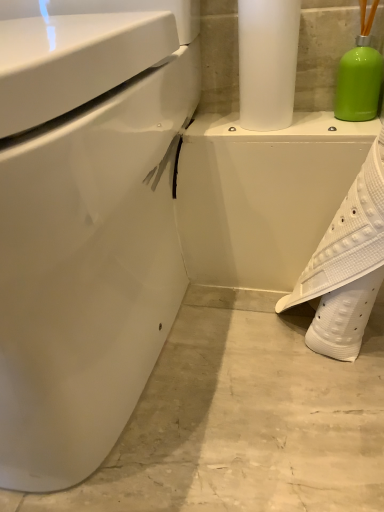
Describe the element at coordinates (267, 62) in the screenshot. The width and height of the screenshot is (384, 512). I see `satin white paper towel at upper center` at that location.

Identify the location of white textured shoe at lower right. (346, 266).

You are a GUI agent. You are given a task and a screenshot of the screen. Output one action in this format:
    pyautogui.click(x=<x>, y=<y>)
    Task: Click on the porcelain above the white glossy toilet at left (from the image's perspective)
    
    Given the screenshot: What is the action you would take?
    pyautogui.click(x=263, y=195)

Considering the sizes of objects white glossy toilet at left and white glossy porcelain at center in the image provided, who is smaller, white glossy toilet at left or white glossy porcelain at center?

white glossy porcelain at center.

From a real-world perspective, who is located lower, white glossy toilet at left or white glossy porcelain at center?

white glossy porcelain at center, from a real-world perspective.

Does satin white paper towel at upper center come in front of white glossy porcelain at center?

Yes, satin white paper towel at upper center is closer to the viewer.

Is satin white paper towel at upper center facing away from white glossy porcelain at center?

satin white paper towel at upper center does not have its back to white glossy porcelain at center.

Between satin white paper towel at upper center and white glossy porcelain at center, which one has larger width?

white glossy porcelain at center is wider.

Is satin white paper towel at upper center shorter than white glossy porcelain at center?

No, satin white paper towel at upper center is not shorter than white glossy porcelain at center.

Is point (239, 42) positioned before point (101, 390)?

No, it is behind (101, 390).

Which object is positioned more to the left, satin white paper towel at upper center or white glossy toilet at left?

From the viewer's perspective, white glossy toilet at left appears more on the left side.

From the image's perspective, which is above, satin white paper towel at upper center or white glossy toilet at left?

satin white paper towel at upper center appears higher in the image.

Who is smaller, white textured shoe at lower right or white glossy toilet at left?

white textured shoe at lower right.

Is point (350, 258) farther from camera compared to point (42, 438)?

Yes, point (350, 258) is behind point (42, 438).

Is white glossy toilet at left inside white textured shoe at lower right?

No.

Does white textured shoe at lower right appear on the left side of white glossy toilet at left?

Incorrect, white textured shoe at lower right is not on the left side of white glossy toilet at left.

Who is shorter, white textured shoe at lower right or satin white paper towel at upper center?

Standing shorter between the two is satin white paper towel at upper center.

The height and width of the screenshot is (512, 384). Identify the location of paper towel that appears above the white textured shoe at lower right (from the image's perspective). (267, 62).

Is white textured shoe at lower right oriented towards satin white paper towel at upper center?

No, white textured shoe at lower right is not turned towards satin white paper towel at upper center.

Which is more to the left, white textured shoe at lower right or satin white paper towel at upper center?

From the viewer's perspective, satin white paper towel at upper center appears more on the left side.

Which is less distant, [219,123] or [244,16]?

Point [244,16]

How different are the orientations of white glossy porcelain at center and satin white paper towel at upper center in degrees?

1.95 degrees separate the facing orientations of white glossy porcelain at center and satin white paper towel at upper center.

Is satin white paper towel at upper center inside white glossy porcelain at center?

No.

Is white glossy porcelain at center bigger or smaller than white textured shoe at lower right?

In the image, white glossy porcelain at center appears to be larger than white textured shoe at lower right.

From the image's perspective, is white glossy porcelain at center above or below white textured shoe at lower right?

white glossy porcelain at center is above white textured shoe at lower right.

Is white glossy porcelain at center looking in the opposite direction of white textured shoe at lower right?

white glossy porcelain at center is not turned away from white textured shoe at lower right.

In the image, there is a white glossy porcelain at center. Where is `toilet below it (from the image's perspective)`? toilet below it (from the image's perspective) is located at coordinates (86, 221).

At what (x,y) coordinates should I click in order to perform the action: click on paper towel on the left of white glossy porcelain at center. Please return your answer as a coordinate pair (x, y). The height and width of the screenshot is (512, 384). Looking at the image, I should click on (267, 62).

Consider the image. Considering their positions, is white textured shoe at lower right positioned further to satin white paper towel at upper center than white glossy toilet at left?

The object further to satin white paper towel at upper center is white glossy toilet at left.

Based on their spatial positions, is white glossy toilet at left or white glossy porcelain at center further from satin white paper towel at upper center?

Based on the image, white glossy toilet at left appears to be further to satin white paper towel at upper center.

When comparing their distances from white glossy toilet at left, does white glossy porcelain at center or white textured shoe at lower right seem further?

white textured shoe at lower right.

Which object lies further to the anchor point white glossy toilet at left, satin white paper towel at upper center or white textured shoe at lower right?

Among the two, white textured shoe at lower right is located further to white glossy toilet at left.

From the image, which object appears to be farther from white glossy porcelain at center, white glossy toilet at left or white textured shoe at lower right?

white glossy toilet at left lies further to white glossy porcelain at center than the other object.

Based on their spatial positions, is white textured shoe at lower right or white glossy toilet at left closer to white glossy porcelain at center?

The object closer to white glossy porcelain at center is white textured shoe at lower right.

From the picture: Considering their positions, is white glossy porcelain at center positioned further to satin white paper towel at upper center than white glossy toilet at left?

The object further to satin white paper towel at upper center is white glossy toilet at left.

Which object lies nearer to the anchor point white textured shoe at lower right, white glossy toilet at left or white glossy porcelain at center?

white glossy porcelain at center is positioned closer to the anchor white textured shoe at lower right.

I want to click on paper towel located between white glossy toilet at left and white textured shoe at lower right in the left-right direction, so click(267, 62).

Where is `paper towel situated between white glossy toilet at left and white glossy porcelain at center from left to right`? paper towel situated between white glossy toilet at left and white glossy porcelain at center from left to right is located at coordinates (267, 62).

This screenshot has height=512, width=384. I want to click on porcelain situated between white glossy toilet at left and white textured shoe at lower right from left to right, so click(263, 195).

This screenshot has width=384, height=512. In order to click on porcelain between satin white paper towel at upper center and white textured shoe at lower right vertically in this screenshot , I will do `click(263, 195)`.